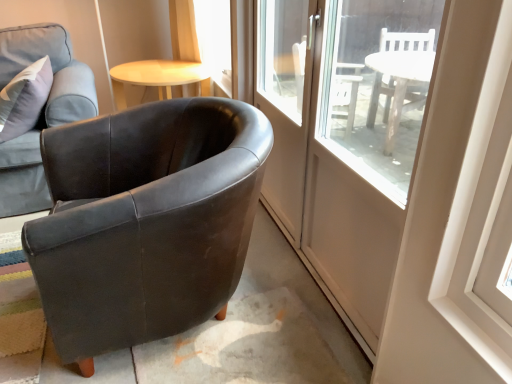
Question: Can you confirm if clear glass door at center is smaller than matte black armchair at left, the first chair in the left-to-right sequence?

Choices:
 (A) yes
 (B) no

Answer: (A)

Question: Is clear glass door at center positioned behind matte black armchair at left, the first chair in the left-to-right sequence?

Choices:
 (A) yes
 (B) no

Answer: (B)

Question: Is clear glass door at center not inside matte black armchair at left, which is the second chair from right to left?

Choices:
 (A) no
 (B) yes

Answer: (B)

Question: Is clear glass door at center wider than matte black armchair at left, the first chair in the left-to-right sequence?

Choices:
 (A) no
 (B) yes

Answer: (A)

Question: From a real-world perspective, is clear glass door at center on matte black armchair at left, the first chair in the left-to-right sequence?

Choices:
 (A) no
 (B) yes

Answer: (B)

Question: Is clear glass door at center at the left side of matte black armchair at left, the first chair in the left-to-right sequence?

Choices:
 (A) yes
 (B) no

Answer: (B)

Question: From a real-world perspective, is clear glass door at center located beneath matte black armchair at left, which appears as the first chair when viewed from the right?

Choices:
 (A) no
 (B) yes

Answer: (A)

Question: Would you say matte black armchair at left, which appears as the first chair when viewed from the right, is part of clear glass door at center's contents?

Choices:
 (A) no
 (B) yes

Answer: (A)

Question: Can you confirm if clear glass door at center is shorter than matte black armchair at left, which appears as the first chair when viewed from the right?

Choices:
 (A) yes
 (B) no

Answer: (B)

Question: Is clear glass door at center looking in the opposite direction of matte black armchair at left, which appears as the first chair when viewed from the right?

Choices:
 (A) yes
 (B) no

Answer: (B)

Question: From the image's perspective, does clear glass door at center appear higher than matte black armchair at left, which is counted as the 2th chair, starting from the left?

Choices:
 (A) no
 (B) yes

Answer: (B)

Question: Would you consider clear glass door at center to be distant from matte black armchair at left, which appears as the first chair when viewed from the right?

Choices:
 (A) no
 (B) yes

Answer: (A)

Question: Is matte black armchair at left, the first chair in the left-to-right sequence, at the right side of clear glass door at center?

Choices:
 (A) no
 (B) yes

Answer: (A)